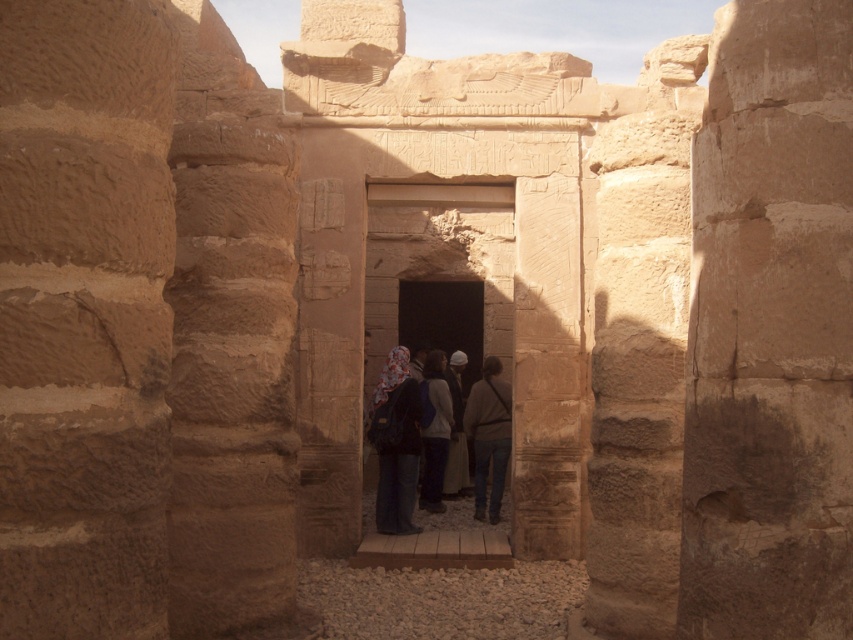
Is brown stone doorway at center bigger than dark brown leather jacket at center?

Yes, brown stone doorway at center is bigger than dark brown leather jacket at center.

Locate an element on the screen. This screenshot has width=853, height=640. brown stone doorway at center is located at coordinates (439, 269).

Which is below, floral-patterned scarf at center or white fabric headscarf at center?

white fabric headscarf at center is below.

Describe the element at coordinates (396, 444) in the screenshot. I see `floral-patterned scarf at center` at that location.

Locate an element on the screen. This screenshot has height=640, width=853. floral-patterned scarf at center is located at coordinates (396, 444).

Which is above, white fabric headscarf at center or dark brown leather jacket at center?

Positioned higher is dark brown leather jacket at center.

From the picture: Who is positioned more to the right, white fabric headscarf at center or dark brown leather jacket at center?

Positioned to the right is dark brown leather jacket at center.

Find the location of a particular element. The width and height of the screenshot is (853, 640). white fabric headscarf at center is located at coordinates (434, 432).